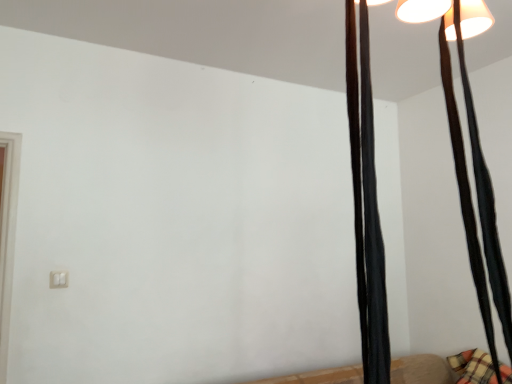
The width and height of the screenshot is (512, 384). Describe the element at coordinates (485, 202) in the screenshot. I see `black fabric curtain at upper right, which ranks as the 1th curtain in right-to-left order` at that location.

Identify the location of black fabric curtain at upper right, which is counted as the 2th curtain, starting from the front. (485, 202).

What do you see at coordinates (366, 205) in the screenshot? I see `black fabric curtain at right, which is the second curtain in back-to-front order` at bounding box center [366, 205].

Where is `black fabric curtain at right, which is counted as the second curtain, starting from the right`? The image size is (512, 384). black fabric curtain at right, which is counted as the second curtain, starting from the right is located at coordinates (366, 205).

Identify the location of black fabric curtain at upper right, which ranks as the 1th curtain in right-to-left order. (485, 202).

Is black fabric curtain at upper right, which is counted as the 2th curtain, starting from the front, to the left of black fabric curtain at right, which is the first curtain from left to right, from the viewer's perspective?

Incorrect, black fabric curtain at upper right, which is counted as the 2th curtain, starting from the front, is not on the left side of black fabric curtain at right, which is the first curtain from left to right.

Considering the positions of objects black fabric curtain at upper right, the 2th curtain viewed from the left, and black fabric curtain at right, which is the second curtain in back-to-front order, in the image provided, who is behind, black fabric curtain at upper right, the 2th curtain viewed from the left, or black fabric curtain at right, which is the second curtain in back-to-front order,?

black fabric curtain at upper right, the 2th curtain viewed from the left, is further away from the camera.

Considering the positions of point (504, 326) and point (366, 270), is point (504, 326) closer or farther from the camera than point (366, 270)?

Clearly, point (504, 326) is more distant from the camera than point (366, 270).

From the image's perspective, which is below, black fabric curtain at upper right, the 2th curtain viewed from the left, or black fabric curtain at right, which is the second curtain in back-to-front order?

black fabric curtain at right, which is the second curtain in back-to-front order.

From a real-world perspective, is black fabric curtain at upper right, the 1th curtain in the back-to-front sequence, located higher than black fabric curtain at right, which is the second curtain in back-to-front order?

Yes, from a real-world perspective, black fabric curtain at upper right, the 1th curtain in the back-to-front sequence, is above black fabric curtain at right, which is the second curtain in back-to-front order.

In the scene shown: Is black fabric curtain at upper right, the 1th curtain in the back-to-front sequence, wider than black fabric curtain at right, which is the second curtain in back-to-front order?

Yes.

In the scene shown: Does black fabric curtain at upper right, which ranks as the 1th curtain in right-to-left order, have a lesser height compared to black fabric curtain at right, which is the 1th curtain from front to back?

No, black fabric curtain at upper right, which ranks as the 1th curtain in right-to-left order, is not shorter than black fabric curtain at right, which is the 1th curtain from front to back.

Is black fabric curtain at upper right, the 2th curtain viewed from the left, bigger or smaller than black fabric curtain at right, which is the second curtain in back-to-front order?

Considering their sizes, black fabric curtain at upper right, the 2th curtain viewed from the left, takes up more space than black fabric curtain at right, which is the second curtain in back-to-front order.

In the scene shown: Is black fabric curtain at upper right, which ranks as the 1th curtain in right-to-left order, positioned beyond the bounds of black fabric curtain at right, which is the 1th curtain from front to back?

Yes, black fabric curtain at upper right, which ranks as the 1th curtain in right-to-left order, is not within black fabric curtain at right, which is the 1th curtain from front to back.

Are black fabric curtain at upper right, the 2th curtain viewed from the left, and black fabric curtain at right, which is the second curtain in back-to-front order, beside each other?

black fabric curtain at upper right, the 2th curtain viewed from the left, and black fabric curtain at right, which is the second curtain in back-to-front order, are not in contact.

Is black fabric curtain at upper right, the 1th curtain in the back-to-front sequence, facing towards black fabric curtain at right, which is the second curtain in back-to-front order?

No, black fabric curtain at upper right, the 1th curtain in the back-to-front sequence, is not oriented towards black fabric curtain at right, which is the second curtain in back-to-front order.

How many degrees apart are the facing directions of black fabric curtain at upper right, the 1th curtain in the back-to-front sequence, and black fabric curtain at right, which is the first curtain from left to right?

0.000632 degrees separate the facing orientations of black fabric curtain at upper right, the 1th curtain in the back-to-front sequence, and black fabric curtain at right, which is the first curtain from left to right.

How distant is black fabric curtain at upper right, which ranks as the 1th curtain in right-to-left order, from black fabric curtain at right, which is counted as the second curtain, starting from the right?

black fabric curtain at upper right, which ranks as the 1th curtain in right-to-left order, and black fabric curtain at right, which is counted as the second curtain, starting from the right, are 11.00 inches apart.

The height and width of the screenshot is (384, 512). I want to click on curtain that appears on the left of black fabric curtain at upper right, the 2th curtain viewed from the left, so click(366, 205).

Would you say black fabric curtain at right, which is counted as the second curtain, starting from the right, is to the left or to the right of black fabric curtain at upper right, the 1th curtain in the back-to-front sequence, in the picture?

Clearly, black fabric curtain at right, which is counted as the second curtain, starting from the right, is on the left of black fabric curtain at upper right, the 1th curtain in the back-to-front sequence, in the image.

Based on the photo, is black fabric curtain at right, which is the 1th curtain from front to back, in front of or behind black fabric curtain at upper right, the 2th curtain viewed from the left, in the image?

Clearly, black fabric curtain at right, which is the 1th curtain from front to back, is in front of black fabric curtain at upper right, the 2th curtain viewed from the left.

Which is behind, point (356, 69) or point (454, 131)?

The point (454, 131) is farther from the camera.

In the scene shown: From the image's perspective, which is below, black fabric curtain at right, which is the 1th curtain from front to back, or black fabric curtain at upper right, the 1th curtain in the back-to-front sequence?

black fabric curtain at right, which is the 1th curtain from front to back, appears lower in the image.

From a real-world perspective, is black fabric curtain at right, which is the second curtain in back-to-front order, over black fabric curtain at upper right, which is counted as the 2th curtain, starting from the front?

Incorrect, from a real-world perspective, black fabric curtain at right, which is the second curtain in back-to-front order, is lower than black fabric curtain at upper right, which is counted as the 2th curtain, starting from the front.

Can you confirm if black fabric curtain at right, which is the second curtain in back-to-front order, is thinner than black fabric curtain at upper right, which is counted as the 2th curtain, starting from the front?

Correct, the width of black fabric curtain at right, which is the second curtain in back-to-front order, is less than that of black fabric curtain at upper right, which is counted as the 2th curtain, starting from the front.

Looking at this image, which of these two, black fabric curtain at right, which is the second curtain in back-to-front order, or black fabric curtain at upper right, the 1th curtain in the back-to-front sequence, stands shorter?

With less height is black fabric curtain at right, which is the second curtain in back-to-front order.

Looking at the image, does black fabric curtain at right, which is the second curtain in back-to-front order, seem bigger or smaller compared to black fabric curtain at upper right, the 2th curtain viewed from the left?

Considering their sizes, black fabric curtain at right, which is the second curtain in back-to-front order, takes up less space than black fabric curtain at upper right, the 2th curtain viewed from the left.

Could black fabric curtain at upper right, the 2th curtain viewed from the left, be considered to be inside black fabric curtain at right, which is the first curtain from left to right?

No, black fabric curtain at upper right, the 2th curtain viewed from the left, is not surrounded by black fabric curtain at right, which is the first curtain from left to right.

Is the surface of black fabric curtain at right, which is the first curtain from left to right, in direct contact with black fabric curtain at upper right, which is counted as the 2th curtain, starting from the front?

No, black fabric curtain at right, which is the first curtain from left to right, is not with black fabric curtain at upper right, which is counted as the 2th curtain, starting from the front.

Could you tell me if black fabric curtain at right, which is the first curtain from left to right, is turned towards black fabric curtain at upper right, which is counted as the 2th curtain, starting from the front?

No, black fabric curtain at right, which is the first curtain from left to right, is not aimed at black fabric curtain at upper right, which is counted as the 2th curtain, starting from the front.

Can you tell me how much black fabric curtain at right, which is the 1th curtain from front to back, and black fabric curtain at upper right, which ranks as the 1th curtain in right-to-left order, differ in facing direction?

0.000632 degrees separate the facing orientations of black fabric curtain at right, which is the 1th curtain from front to back, and black fabric curtain at upper right, which ranks as the 1th curtain in right-to-left order.

Find the location of a particular element. The height and width of the screenshot is (384, 512). curtain on the right of black fabric curtain at right, which is the second curtain in back-to-front order is located at coordinates (485, 202).

Locate an element on the screen. This screenshot has height=384, width=512. curtain on the left of black fabric curtain at upper right, which is counted as the 2th curtain, starting from the front is located at coordinates (366, 205).

This screenshot has height=384, width=512. Find the location of `curtain that is below the black fabric curtain at upper right, which ranks as the 1th curtain in right-to-left order (from the image's perspective)`. curtain that is below the black fabric curtain at upper right, which ranks as the 1th curtain in right-to-left order (from the image's perspective) is located at coordinates (366, 205).